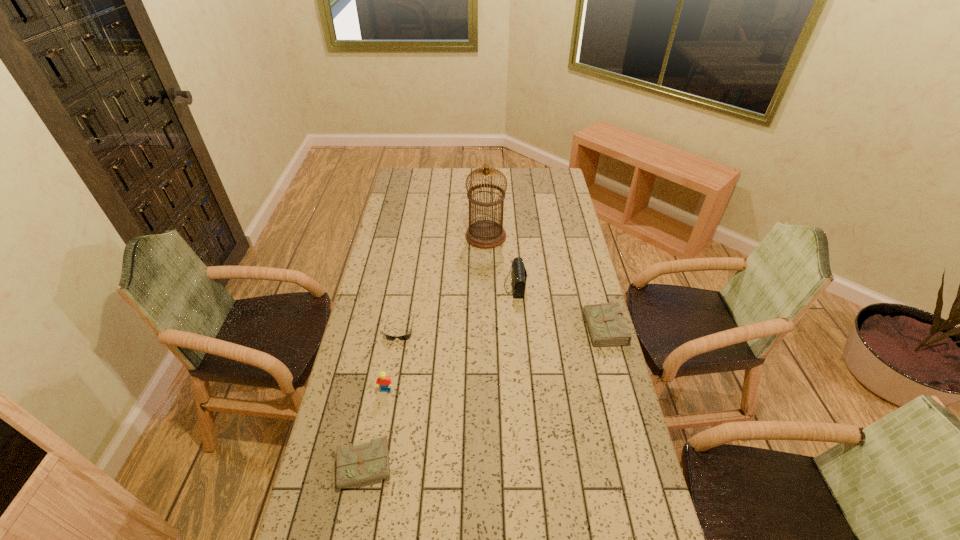
Find the location of a particular element. The width and height of the screenshot is (960, 540). vacant region between the shortest object and the fifth nearest object is located at coordinates point(457,307).

I want to click on vacant space that's between the second nearest object and the taller diary, so click(496, 362).

Locate an element on the screen. unoccupied position between the Lego and the clutch bag is located at coordinates (450, 338).

Identify the location of vacant space that is in between the second shortest object and the clutch bag. (443, 376).

What are the coordinates of `free space between the clutch bag and the right diary` in the screenshot? It's located at (561, 310).

You are a GUI agent. You are given a task and a screenshot of the screen. Output one action in this format:
    pyautogui.click(x=<x>, y=<y>)
    Task: Click on the vacant area that lies between the fifth nearest object and the birdcage
    
    Given the screenshot: What is the action you would take?
    pyautogui.click(x=500, y=261)

This screenshot has width=960, height=540. Identify the location of unoccupied area between the Lego and the farther diary. (496, 362).

Identify the location of free space between the nearer diary and the Lego. click(378, 428).

Where is `vacant area that lies between the fifth nearest object and the Lego`? The width and height of the screenshot is (960, 540). vacant area that lies between the fifth nearest object and the Lego is located at coordinates (450, 338).

At what (x,y) coordinates should I click in order to perform the action: click on free spot between the birdcage and the second farthest object. Please return your answer as a coordinate pair (x, y). The image size is (960, 540). Looking at the image, I should click on (500, 261).